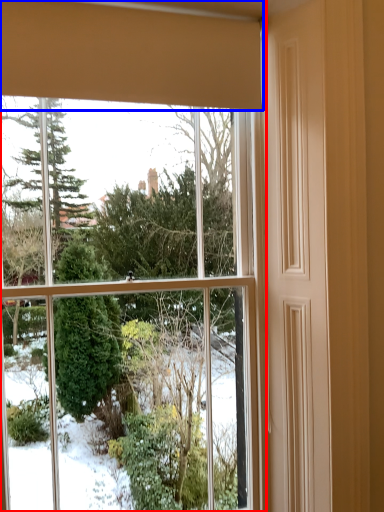
Question: Which object appears farthest to the camera in this image, window (highlighted by a red box) or curtain (highlighted by a blue box)?

Choices:
 (A) window
 (B) curtain

Answer: (A)